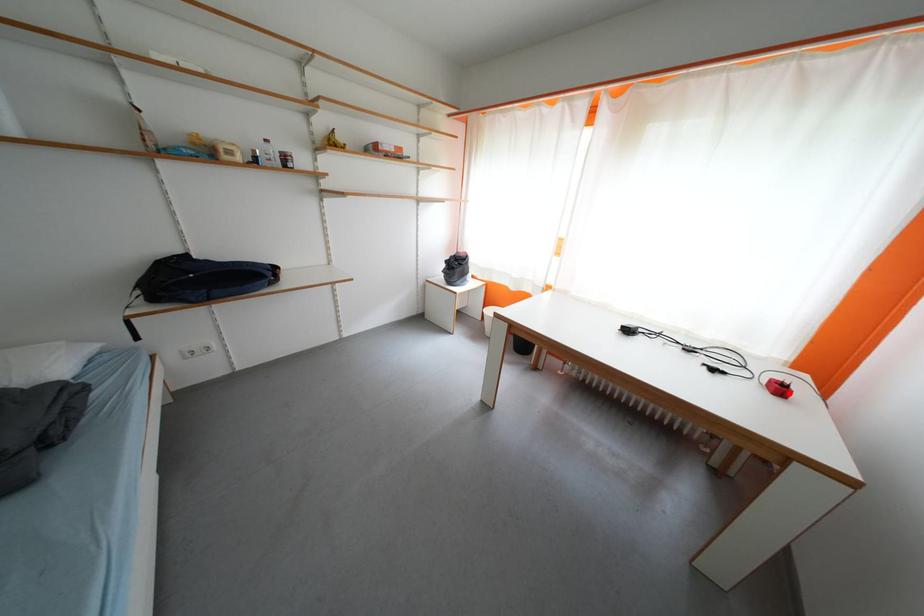
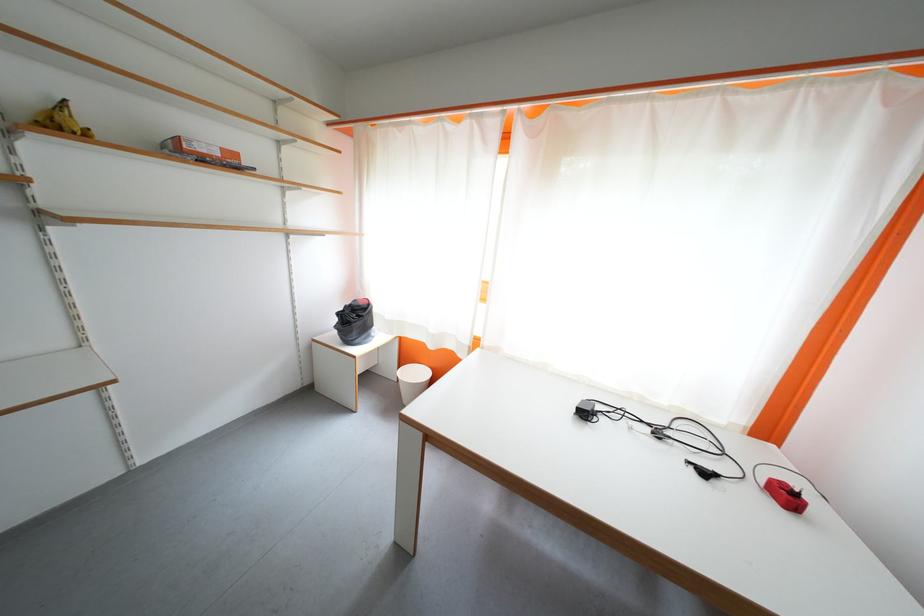
Locate, in the second image, the point that corresponds to the highlighted location in the first image.

(796, 500)